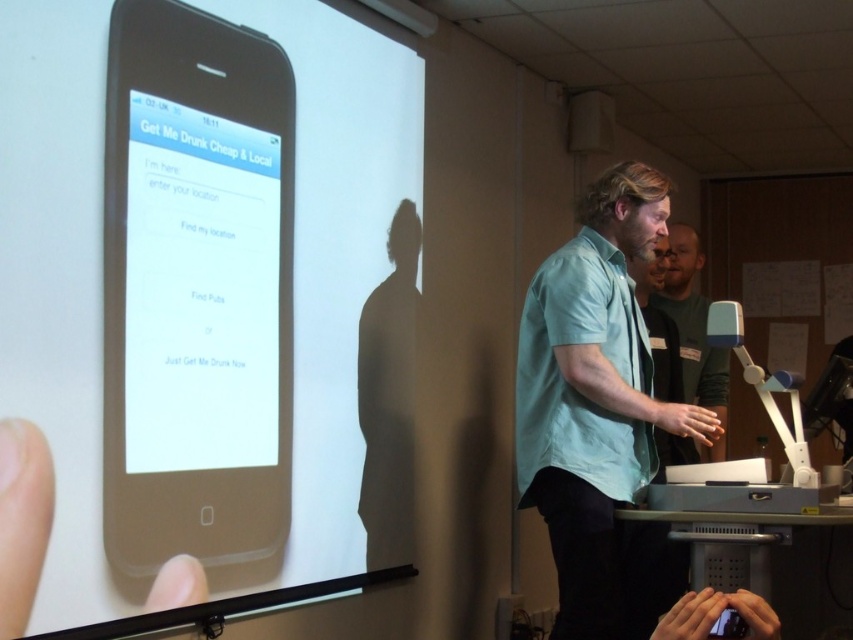
Is point (328, 296) farther from viewer compared to point (585, 280)?

Yes.

Who is more distant from viewer, (48, 106) or (569, 488)?

The point (569, 488) is behind.

Identify the location of matte black phone at upper left. (195, 284).

Between light blue cotton shirt at center and dark green shirt at right, which one appears on the right side from the viewer's perspective?

Positioned to the right is dark green shirt at right.

Does light blue cotton shirt at center have a larger size compared to dark green shirt at right?

Actually, light blue cotton shirt at center might be smaller than dark green shirt at right.

Does point (584, 224) lie in front of point (664, 304)?

Yes, it is in front of point (664, 304).

I want to click on light blue cotton shirt at center, so click(x=602, y=410).

Which of these two, matte black phone at upper left or dark green shirt at right, stands taller?

matte black phone at upper left

Can you confirm if matte black phone at upper left is bigger than dark green shirt at right?

Yes, matte black phone at upper left is bigger than dark green shirt at right.

Is point (387, 60) positioned before point (704, 458)?

Yes.

Find the location of `matte black phone at upper left`. matte black phone at upper left is located at coordinates point(195,284).